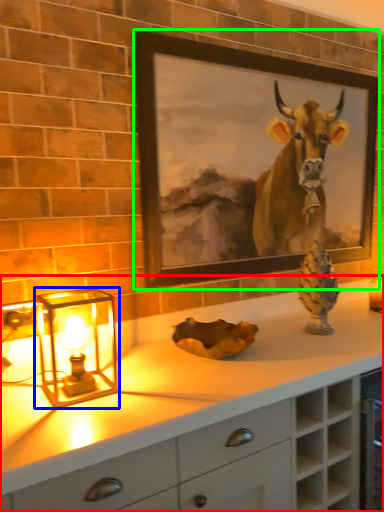
Question: Based on their relative distances, which object is nearer to countertop (highlighted by a red box)? Choose from table lamp (highlighted by a blue box) and picture frame (highlighted by a green box).

Choices:
 (A) table lamp
 (B) picture frame

Answer: (A)